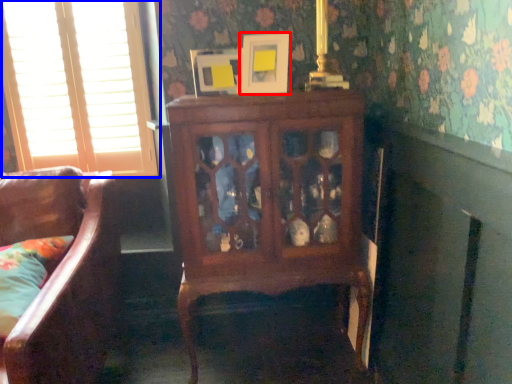
Question: Among these objects, which one is farthest to the camera, picture frame (highlighted by a red box) or window (highlighted by a blue box)?

Choices:
 (A) picture frame
 (B) window

Answer: (B)